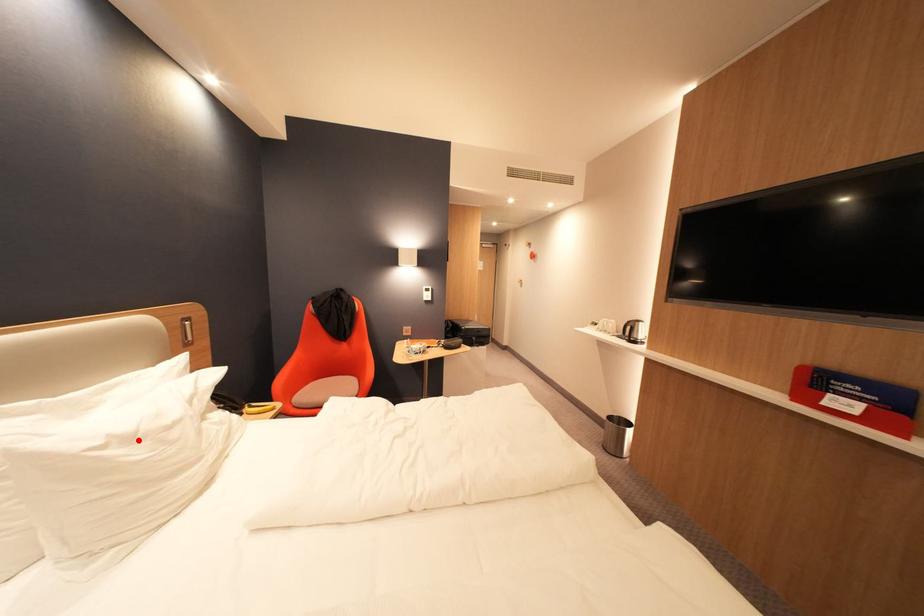
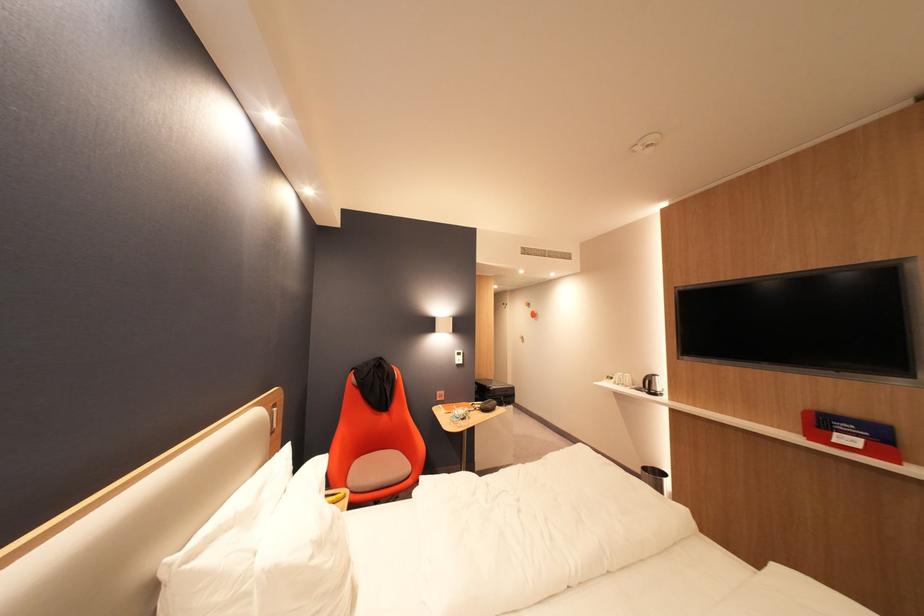
Where in the second image is the point corresponding to the highlighted location from the first image?

(330, 545)